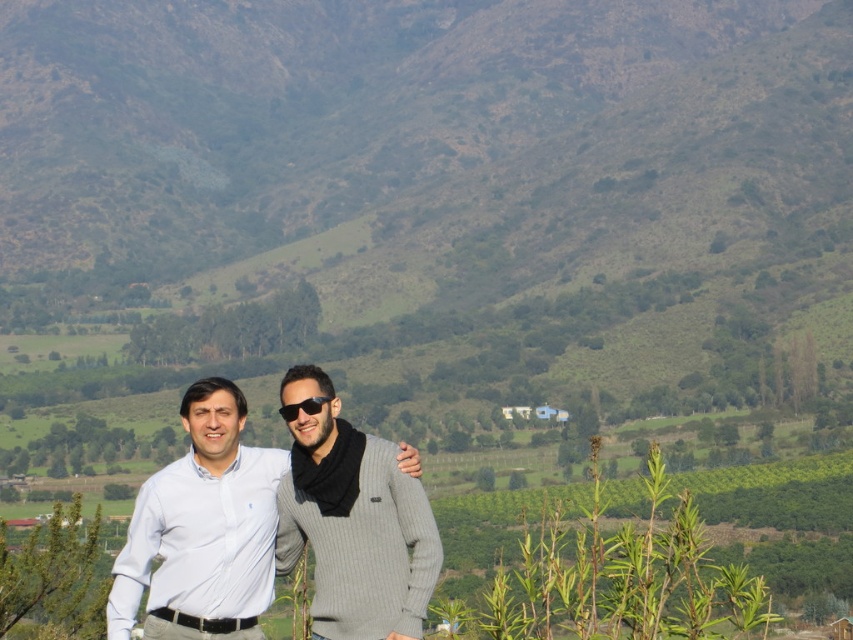
From the picture: You are a photographer setting up a camera to capture two people dressed in white cotton shirt at center and gray ribbed sweater at center. You need to ensure that both individuals fit within the frame. Given that the camera has a fixed width of 1.2 meters, will the combined width of the two individuals exceed the camera frame?

The white cotton shirt at center is wider than the gray ribbed sweater at center. However, without knowing the exact widths of both individuals, it is impossible to determine if their combined width exceeds the camera frame of 1.2 meters. Additional information about their individual measurements is required to answer this accurately.

You are standing at point point [230,586] and want to take a photo of the two people in the scene. The camera you have can focus on subjects within 50 meters. Will the camera be able to capture a clear photo of the two people?

The distance between point [230,586] and the camera is 49.57 meters, which is within the camera focus range of 50 meters. Therefore, the camera can capture a clear photo of the two people.